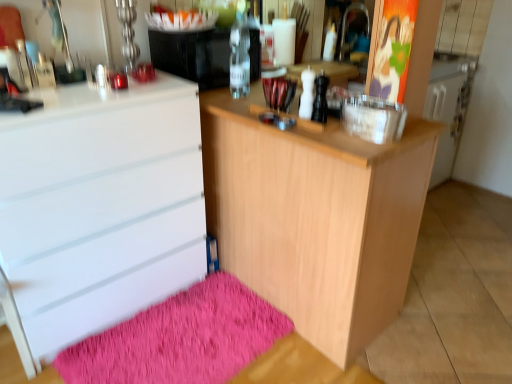
What is the approximate height of shaggy pink bath mat at lower left?

It is 2.39 inches.

Describe the element at coordinates (316, 217) in the screenshot. The width and height of the screenshot is (512, 384). I see `light wood cabinet at center` at that location.

What do you see at coordinates (97, 209) in the screenshot? I see `white glossy chest of drawers at left` at bounding box center [97, 209].

Locate an element on the screen. This screenshot has height=384, width=512. clear glass water bottle at center is located at coordinates (193, 55).

From a real-world perspective, which is physically below, clear glass bottle at center or clear glass water bottle at center?

clear glass water bottle at center, from a real-world perspective.

Is point (246, 21) positioned after point (206, 58)?

Yes.

Is clear glass water bottle at center next to clear glass bottle at center and touching it?

They are not placed beside each other.

In terms of width, does clear glass water bottle at center look wider or thinner when compared to clear glass bottle at center?

In the image, clear glass water bottle at center appears to be wider than clear glass bottle at center.

From their relative heights in the image, would you say clear glass water bottle at center is taller or shorter than clear glass bottle at center?

Considering their sizes, clear glass water bottle at center has less height than clear glass bottle at center.

From the image's perspective, is clear glass water bottle at center on clear glass bottle at center?

Indeed, from the image's perspective, clear glass water bottle at center is shown above clear glass bottle at center.

How many degrees apart are the facing directions of white glossy chest of drawers at left and clear glass bottle at center?

89.3 degrees.

Based on the photo, which object is more forward, white glossy chest of drawers at left or clear glass bottle at center?

white glossy chest of drawers at left is in front.

Is white glossy chest of drawers at left not near clear glass bottle at center?

That's not correct — white glossy chest of drawers at left is a little close to clear glass bottle at center.

Is white glossy chest of drawers at left bigger than clear glass bottle at center?

Yes, white glossy chest of drawers at left is bigger than clear glass bottle at center.

From their relative heights in the image, would you say white glossy chest of drawers at left is taller or shorter than shaggy pink bath mat at lower left?

In the image, white glossy chest of drawers at left appears to be taller than shaggy pink bath mat at lower left.

Is white glossy chest of drawers at left facing away from shaggy pink bath mat at lower left?

No, white glossy chest of drawers at left is not facing away from shaggy pink bath mat at lower left.

Which is nearer, (19, 224) or (229, 353)?

Point (19, 224) is positioned closer to the camera compared to point (229, 353).

Is white glossy chest of drawers at left not within shaggy pink bath mat at lower left?

white glossy chest of drawers at left lies outside shaggy pink bath mat at lower left's area.

From the image's perspective, is shaggy pink bath mat at lower left under white glossy chest of drawers at left?

Indeed, from the image's perspective, shaggy pink bath mat at lower left is shown beneath white glossy chest of drawers at left.

What's the angular difference between shaggy pink bath mat at lower left and white glossy chest of drawers at left's facing directions?

They differ by 2.67 degrees in their facing directions.

Does shaggy pink bath mat at lower left contain white glossy chest of drawers at left?

Definitely not — white glossy chest of drawers at left is not inside shaggy pink bath mat at lower left.

Is clear glass bottle at center positioned far away from light wood cabinet at center?

No, clear glass bottle at center is not far away from light wood cabinet at center.

In terms of size, does clear glass bottle at center appear bigger or smaller than light wood cabinet at center?

In the image, clear glass bottle at center appears to be smaller than light wood cabinet at center.

Can you tell me how much clear glass bottle at center and light wood cabinet at center differ in facing direction?

They differ by 88.8 degrees in their facing directions.

In terms of height, does light wood cabinet at center look taller or shorter compared to white glossy chest of drawers at left?

light wood cabinet at center is shorter than white glossy chest of drawers at left.

Is light wood cabinet at center positioned with its back to white glossy chest of drawers at left?

No.

Looking at this image, from a real-world perspective, is light wood cabinet at center located higher than white glossy chest of drawers at left?

No, from a real-world perspective, light wood cabinet at center is not above white glossy chest of drawers at left.

Is white glossy chest of drawers at left a part of light wood cabinet at center?

That's incorrect, white glossy chest of drawers at left is not inside light wood cabinet at center.

Locate an element on the screen. The height and width of the screenshot is (384, 512). appliance behind the clear glass bottle at center is located at coordinates (193, 55).

Identify the location of bottle that is on the right side of clear glass water bottle at center. This screenshot has height=384, width=512. (240, 53).

Which object lies nearer to the anchor point white glossy chest of drawers at left, clear glass bottle at center or shaggy pink bath mat at lower left?

shaggy pink bath mat at lower left lies closer to white glossy chest of drawers at left than the other object.

Which object lies further to the anchor point clear glass water bottle at center, white glossy chest of drawers at left or clear glass bottle at center?

The object further to clear glass water bottle at center is white glossy chest of drawers at left.

When comparing their distances from white glossy chest of drawers at left, does light wood cabinet at center or shaggy pink bath mat at lower left seem closer?

shaggy pink bath mat at lower left is closer to white glossy chest of drawers at left.

Based on their spatial positions, is white glossy chest of drawers at left or shaggy pink bath mat at lower left further from clear glass water bottle at center?

shaggy pink bath mat at lower left is positioned further to the anchor clear glass water bottle at center.

When comparing their distances from clear glass bottle at center, does light wood cabinet at center or white glossy chest of drawers at left seem further?

white glossy chest of drawers at left lies further to clear glass bottle at center than the other object.

Estimate the real-world distances between objects in this image. Which object is closer to clear glass water bottle at center, light wood cabinet at center or clear glass bottle at center?

Among the two, clear glass bottle at center is located nearer to clear glass water bottle at center.

Based on their spatial positions, is shaggy pink bath mat at lower left or white glossy chest of drawers at left further from clear glass bottle at center?

shaggy pink bath mat at lower left is positioned further to the anchor clear glass bottle at center.

Based on their spatial positions, is white glossy chest of drawers at left or clear glass bottle at center closer to light wood cabinet at center?

The object closer to light wood cabinet at center is white glossy chest of drawers at left.

Locate an element on the screen. The width and height of the screenshot is (512, 384). bottle between clear glass water bottle at center and light wood cabinet at center vertically is located at coordinates (240, 53).

Locate an element on the screen. The height and width of the screenshot is (384, 512). appliance located between white glossy chest of drawers at left and light wood cabinet at center in the left-right direction is located at coordinates (193, 55).

Identify the location of bottle that lies between clear glass water bottle at center and shaggy pink bath mat at lower left from top to bottom. The height and width of the screenshot is (384, 512). (240, 53).

I want to click on bottle situated between white glossy chest of drawers at left and light wood cabinet at center from left to right, so click(240, 53).